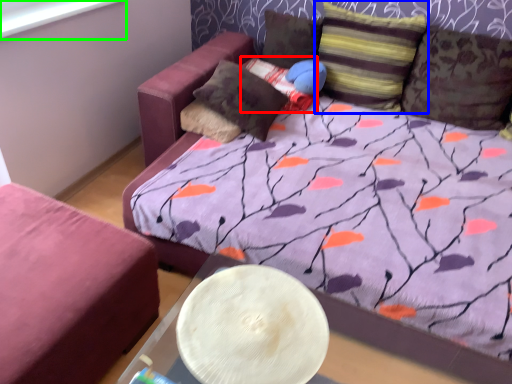
Question: Estimate the real-world distances between objects in this image. Which object is closer to pillow (highlighted by a red box), pillow (highlighted by a blue box) or window screen (highlighted by a green box)?

Choices:
 (A) pillow
 (B) window screen

Answer: (A)